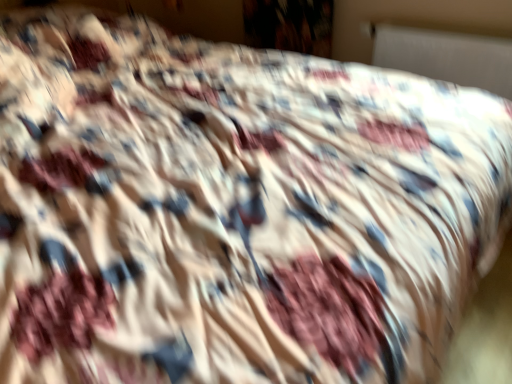
Describe the element at coordinates (446, 56) in the screenshot. I see `white matte radiator at upper right` at that location.

Measure the distance between white matte radiator at upper right and camera.

white matte radiator at upper right and camera are 5.30 feet apart from each other.

The height and width of the screenshot is (384, 512). Find the location of `white matte radiator at upper right`. white matte radiator at upper right is located at coordinates (446, 56).

Identify the location of white matte radiator at upper right. (446, 56).